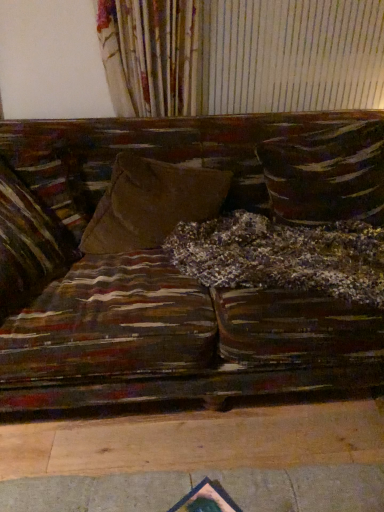
Question: Which direction should I rotate to look at suede-like brown pillow at center, which is the 2th pillow from left to right, — up or down?

Choices:
 (A) up
 (B) down

Answer: (A)

Question: Is textured brown pillow at center, the 3th pillow positioned from the left, shorter than suede-like brown pillow at center, the second pillow when ordered from right to left?

Choices:
 (A) no
 (B) yes

Answer: (A)

Question: From the image's perspective, is textured brown pillow at center, the 3th pillow positioned from the left, on top of suede-like brown pillow at center, which is the 2th pillow from left to right?

Choices:
 (A) no
 (B) yes

Answer: (B)

Question: Considering the relative sizes of textured brown pillow at center, the 1th pillow in the right-to-left sequence, and suede-like brown pillow at center, which is the 2th pillow from left to right, in the image provided, is textured brown pillow at center, the 1th pillow in the right-to-left sequence, taller than suede-like brown pillow at center, which is the 2th pillow from left to right,?

Choices:
 (A) no
 (B) yes

Answer: (B)

Question: Is textured brown pillow at center, the 1th pillow in the right-to-left sequence, oriented towards suede-like brown pillow at center, which is the 2th pillow from left to right?

Choices:
 (A) yes
 (B) no

Answer: (B)

Question: From a real-world perspective, is textured brown pillow at center, the 3th pillow positioned from the left, below suede-like brown pillow at center, which is the 2th pillow from left to right?

Choices:
 (A) yes
 (B) no

Answer: (B)

Question: From a real-world perspective, is textured brown pillow at center, the 3th pillow positioned from the left, over suede-like brown pillow at center, which is the 2th pillow from left to right?

Choices:
 (A) yes
 (B) no

Answer: (A)

Question: From the image's perspective, is textured brown pillow at center, the 3th pillow positioned from the left, on top of velvet brown pillow at left, the 1th pillow positioned from the left?

Choices:
 (A) no
 (B) yes

Answer: (B)

Question: From the image's perspective, is textured brown pillow at center, the 1th pillow in the right-to-left sequence, beneath velvet brown pillow at left, positioned as the 3th pillow in right-to-left order?

Choices:
 (A) yes
 (B) no

Answer: (B)

Question: Is textured brown pillow at center, the 1th pillow in the right-to-left sequence, outside velvet brown pillow at left, positioned as the 3th pillow in right-to-left order?

Choices:
 (A) no
 (B) yes

Answer: (B)

Question: Is textured brown pillow at center, the 3th pillow positioned from the left, positioned behind velvet brown pillow at left, the 1th pillow positioned from the left?

Choices:
 (A) yes
 (B) no

Answer: (A)

Question: Are textured brown pillow at center, the 1th pillow in the right-to-left sequence, and velvet brown pillow at left, the 1th pillow positioned from the left, making contact?

Choices:
 (A) no
 (B) yes

Answer: (A)

Question: Does textured brown pillow at center, the 1th pillow in the right-to-left sequence, have a greater width compared to velvet brown pillow at left, the 1th pillow positioned from the left?

Choices:
 (A) yes
 (B) no

Answer: (A)

Question: Considering the relative sizes of velvet brown pillow at left, the 1th pillow positioned from the left, and textured brown pillow at center, the 3th pillow positioned from the left, in the image provided, is velvet brown pillow at left, the 1th pillow positioned from the left, bigger than textured brown pillow at center, the 3th pillow positioned from the left,?

Choices:
 (A) yes
 (B) no

Answer: (B)